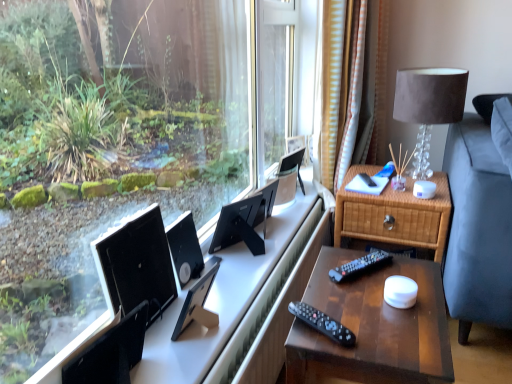
This screenshot has width=512, height=384. What are the coordinates of `free space in front of matte black monitor at center, which appears as the second computer monitor when viewed from the front` in the screenshot? It's located at (198, 358).